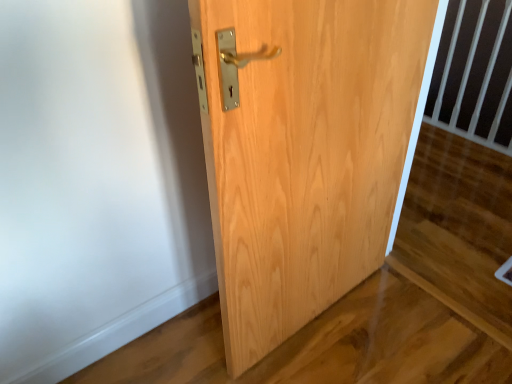
You are a GUI agent. You are given a task and a screenshot of the screen. Output one action in this format:
    pyautogui.click(x=<x>, y=<y>)
    Task: Click on the free space on the front side of black plastic balustrade at upper right
    
    Given the screenshot: What is the action you would take?
    pyautogui.click(x=470, y=157)